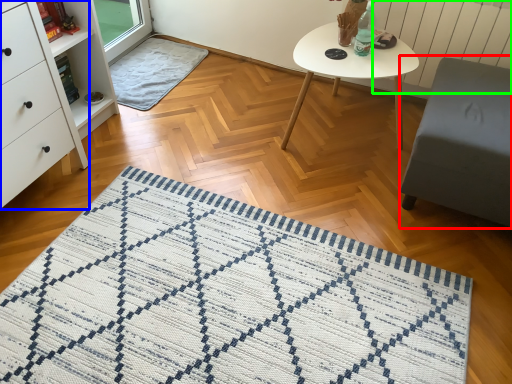
Question: Which is farther away from swivel chair (highlighted by a red box)? chest of drawers (highlighted by a blue box) or radiator (highlighted by a green box)?

Choices:
 (A) chest of drawers
 (B) radiator

Answer: (A)